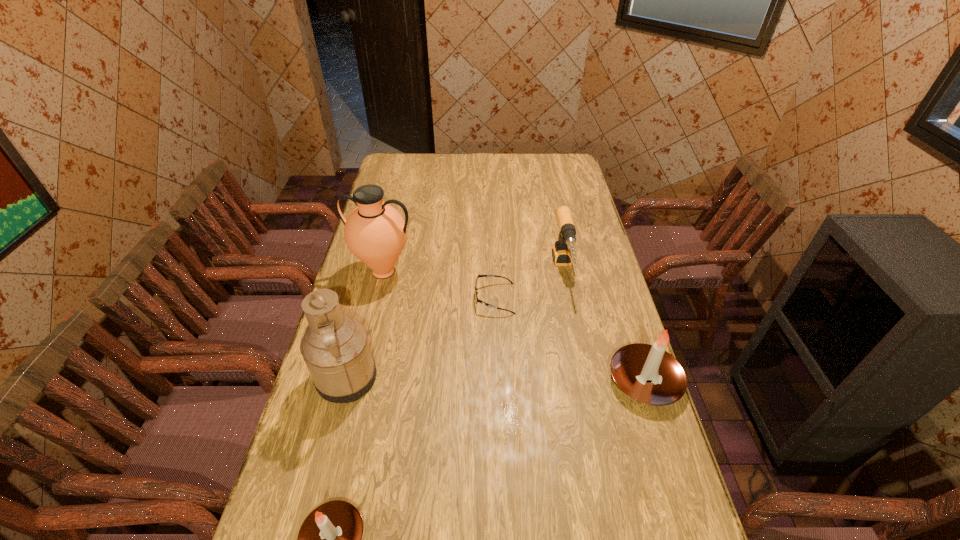
Where is `vacant region located on the front-facing side of the sunglasses`? vacant region located on the front-facing side of the sunglasses is located at coordinates (363, 298).

Where is `free space located 0.320m on the front-facing side of the sunglasses`? free space located 0.320m on the front-facing side of the sunglasses is located at coordinates (381, 298).

This screenshot has width=960, height=540. What are the coordinates of `vacant region located on the front of the nearer pitcher` in the screenshot? It's located at (324, 465).

Image resolution: width=960 pixels, height=540 pixels. Find the location of `vacant space located on the right of the farther pitcher`. vacant space located on the right of the farther pitcher is located at coordinates (455, 272).

Locate an element on the screen. This screenshot has height=540, width=960. free spot located on the handle side of the second object from right to left is located at coordinates (578, 336).

Locate an element on the screen. candle positioned at the right edge is located at coordinates (647, 373).

This screenshot has width=960, height=540. In order to click on drill that is at the right edge in this screenshot , I will do `click(561, 253)`.

Find the location of a particular element. vacant space at the far edge of the desktop is located at coordinates (500, 177).

Locate an element on the screen. The image size is (960, 540). free space at the near edge of the desktop is located at coordinates (477, 533).

In the image, there is a desktop. Where is `free space at the left edge`? The height and width of the screenshot is (540, 960). free space at the left edge is located at coordinates (355, 271).